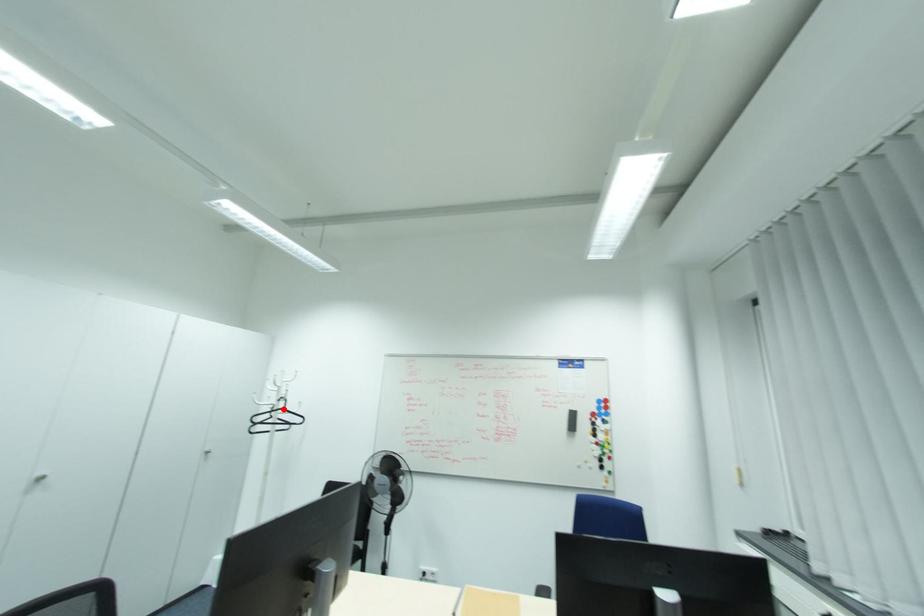
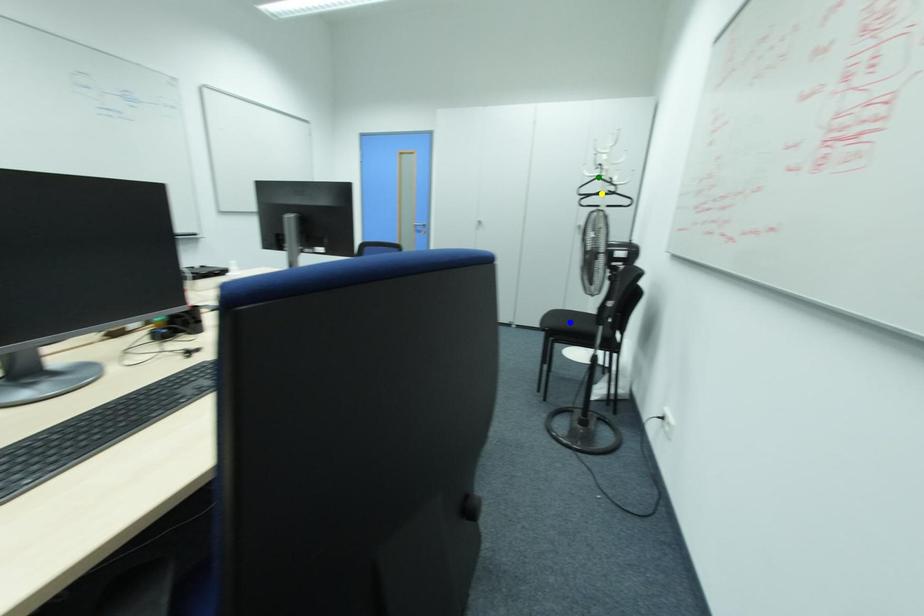
Question: I am providing you with two images of the same scene from different viewpoints. A red point is marked on the first image. You are given multiple points on the second image. In image 2, which mark is for the same physical point as the one in image 1?

Choices:
 (A) green point
 (B) yellow point
 (C) blue point

Answer: (A)